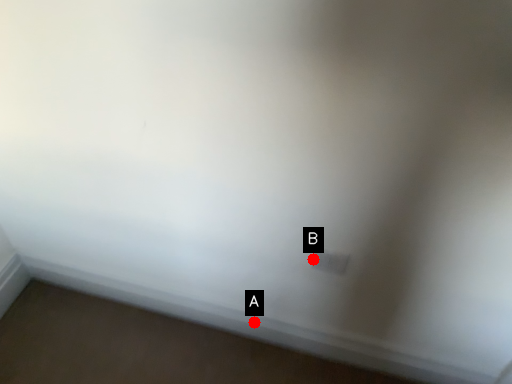
Question: Two points are circled on the image, labeled by A and B beside each circle. Which point is closer to the camera?

Choices:
 (A) A is closer
 (B) B is closer

Answer: (B)